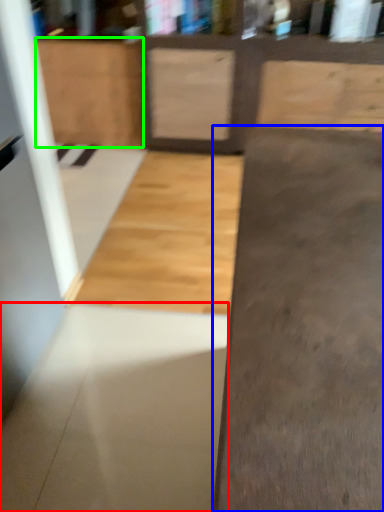
Question: Estimate the real-world distances between objects in this image. Which object is farther from concrete (highlighted by a red box), concrete (highlighted by a blue box) or cabinetry (highlighted by a green box)?

Choices:
 (A) concrete
 (B) cabinetry

Answer: (B)